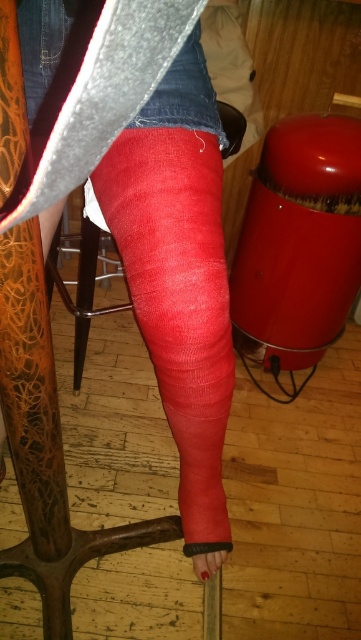
You are a physical therapist examining a patient with a leg injury. The patient has a matte red cast at center and a matte red bandage at lower center. Which of these items is positioned higher on the leg?

The matte red cast at center is positioned higher on the leg than the matte red bandage at lower center because it is located above it.